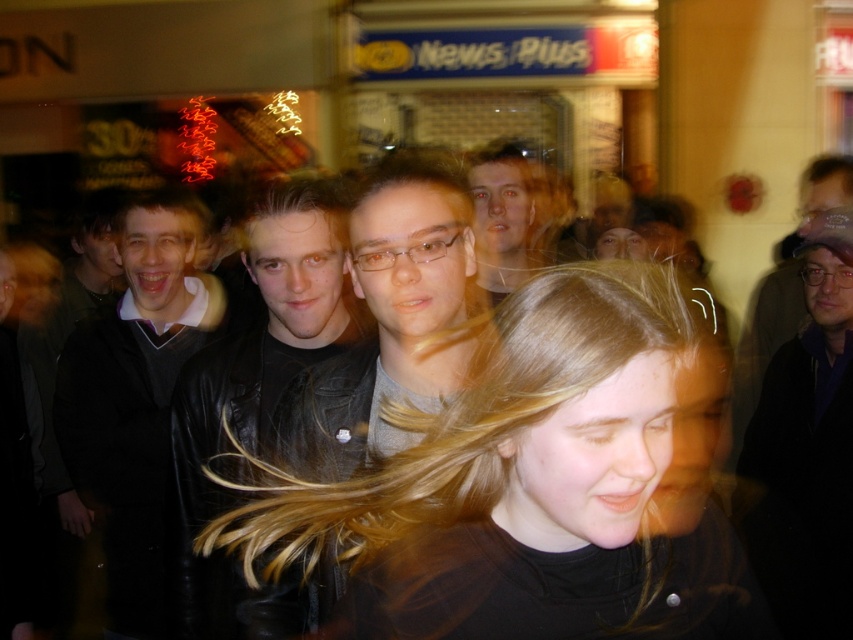
Question: Among these points, which one is farthest from the camera?

Choices:
 (A) (497, 280)
 (B) (183, 417)
 (C) (798, 378)

Answer: (A)

Question: Estimate the real-world distances between objects in this image. Which object is closer to the matte black jacket at center?

Choices:
 (A) black leather jacket at center
 (B) dark blue leather jacket at right

Answer: (A)

Question: Is blonde hair at center to the right of leather jacket at center from the viewer's perspective?

Choices:
 (A) no
 (B) yes

Answer: (B)

Question: Does black leather jacket at center appear under dark gray sweater at left?

Choices:
 (A) no
 (B) yes

Answer: (A)

Question: Which of these objects is positioned farthest from the blonde hair at left?

Choices:
 (A) dark blue leather jacket at right
 (B) blonde hair at center
 (C) leather jacket at center

Answer: (A)

Question: Does dark gray sweater at left have a smaller size compared to matte black jacket at center?

Choices:
 (A) yes
 (B) no

Answer: (B)